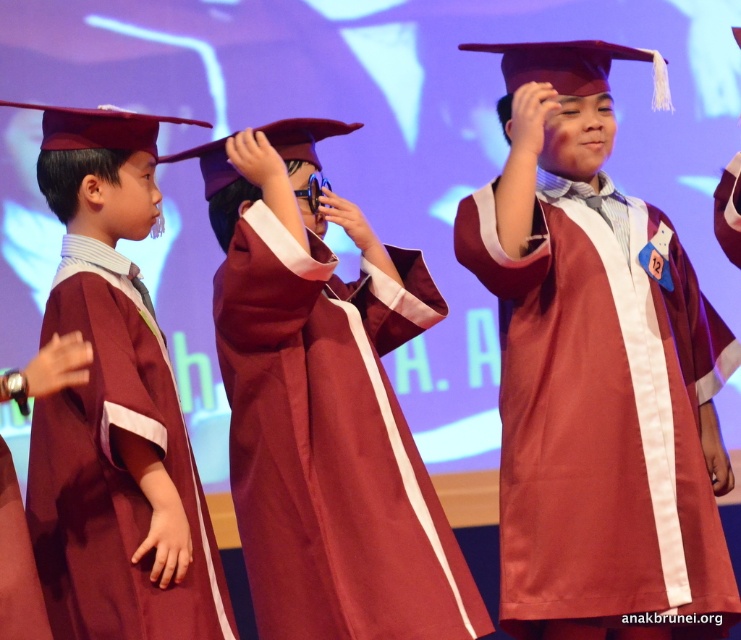
Question: Is maroon satin graduation gown at center wider than maroon satin graduation gown at left?

Choices:
 (A) yes
 (B) no

Answer: (A)

Question: Among these points, which one is farthest from the camera?

Choices:
 (A) tap(104, 481)
 (B) tap(551, 554)

Answer: (B)

Question: Which object is closer to the camera taking this photo?

Choices:
 (A) maroon matte graduation gown at center
 (B) maroon satin graduation gown at center
 (C) maroon satin graduation gown at left

Answer: (C)

Question: Which of these objects is positioned closest to the maroon matte graduation gown at center?

Choices:
 (A) maroon satin graduation gown at center
 (B) maroon satin graduation gown at left

Answer: (A)

Question: Can you confirm if maroon matte graduation gown at center is positioned to the right of maroon satin graduation gown at left?

Choices:
 (A) no
 (B) yes

Answer: (B)

Question: Observing the image, what is the correct spatial positioning of maroon matte graduation gown at center in reference to maroon satin graduation gown at center?

Choices:
 (A) above
 (B) below

Answer: (A)